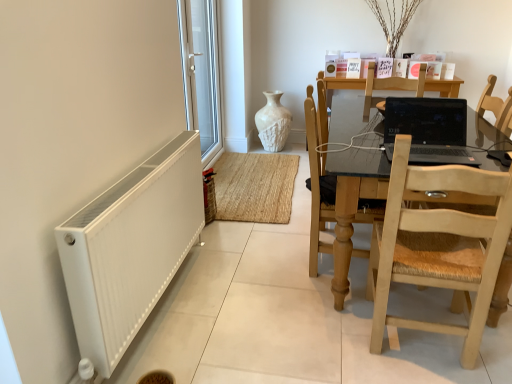
Where is `free point in front of light brown wooden chair at center, arranged as the 2th chair when viewed from the front`? free point in front of light brown wooden chair at center, arranged as the 2th chair when viewed from the front is located at coordinates (333, 305).